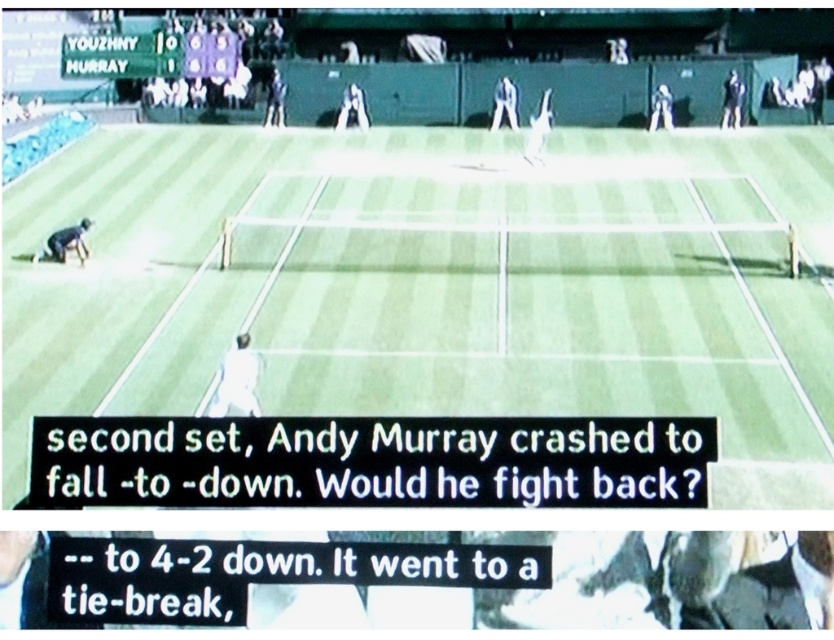
Question: Which point is farther from the camera taking this photo?

Choices:
 (A) (294, 225)
 (B) (275, 120)
 (C) (736, 84)
 (D) (56, 259)

Answer: (B)

Question: Can you confirm if dark blue fabric at lower left is bigger than dark blue jersey at upper center?

Choices:
 (A) no
 (B) yes

Answer: (B)

Question: Does white fabric tennis player at upper center have a greater width compared to dark blue shirt at upper center?

Choices:
 (A) yes
 (B) no

Answer: (B)

Question: Estimate the real-world distances between objects in this image. Which object is farther from the dark blue jersey at upper center?

Choices:
 (A) black fabric person at upper right
 (B) white fabric tennis player at upper center
 (C) white fabric tennis player at center

Answer: (C)

Question: Which point is farther from the camera taking this photo?

Choices:
 (A) (515, 131)
 (B) (74, 236)

Answer: (A)

Question: Can you confirm if white fabric tennis player at center is thinner than white fabric tennis player at upper center?

Choices:
 (A) no
 (B) yes

Answer: (B)